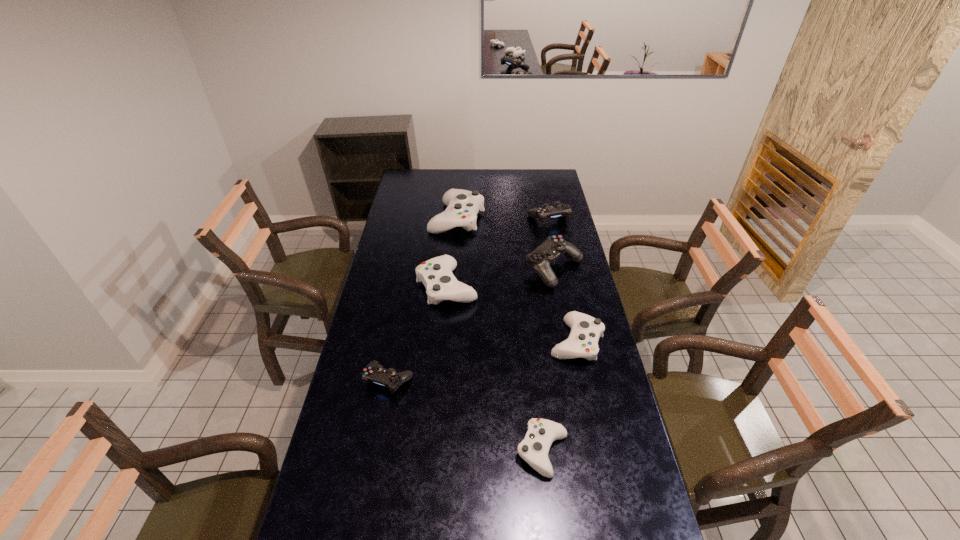
This screenshot has height=540, width=960. I want to click on empty location between the biggest white control and the nearest black control, so click(x=423, y=300).

Image resolution: width=960 pixels, height=540 pixels. I want to click on free space between the biggest white control and the nearest white control, so click(x=500, y=335).

Find the location of a particular element. Image resolution: width=960 pixels, height=540 pixels. vacant area between the second nearest white control and the leftmost black control is located at coordinates (483, 361).

At what (x,y) coordinates should I click in order to perform the action: click on blank region between the second biggest white control and the smallest black control. Please return your answer as a coordinate pair (x, y). Looking at the image, I should click on (418, 333).

Locate which object is the second closest to the leftmost black control. Please provide its 2D coordinates. Your answer should be formatted as a tuple, i.e. [(x, y)], where the tuple contains the x and y coordinates of a point satisfying the conditions above.

[(534, 449)]

Select which object is the closest to the second biggest white control. Please provide its 2D coordinates. Your answer should be formatted as a tuple, i.e. [(x, y)], where the tuple contains the x and y coordinates of a point satisfying the conditions above.

[(543, 256)]

This screenshot has width=960, height=540. What are the coordinates of `control that stands as the third closest to the nearest white control` in the screenshot? It's located at (436, 274).

This screenshot has height=540, width=960. Find the location of `control that can be found as the closest to the nearest white control`. control that can be found as the closest to the nearest white control is located at coordinates (582, 342).

Where is `white control identified as the third closest to the smallest black control`? Image resolution: width=960 pixels, height=540 pixels. white control identified as the third closest to the smallest black control is located at coordinates (582, 342).

I want to click on the fourth closest white control to the biggest black control, so click(x=534, y=449).